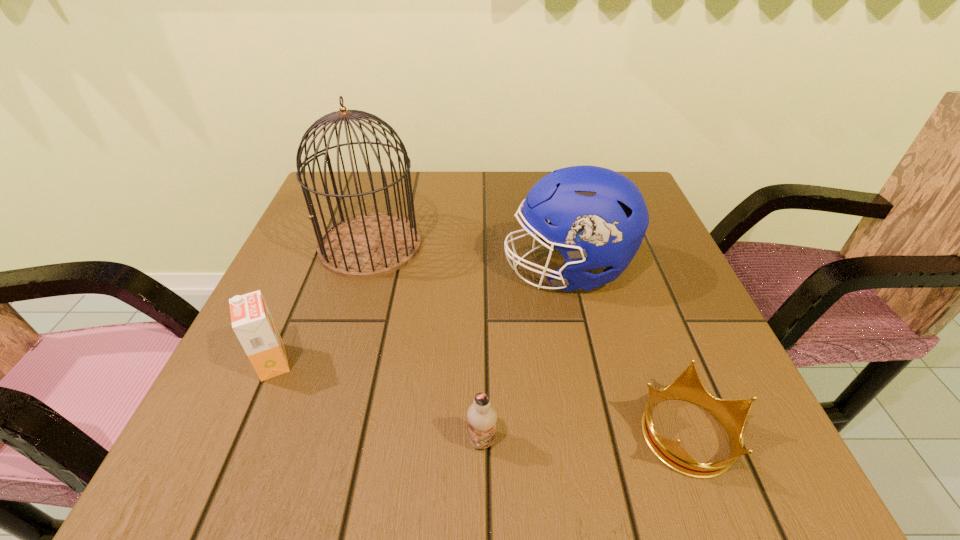
The height and width of the screenshot is (540, 960). Find the location of `vacant space in between the tallest object and the chocolate milk`. vacant space in between the tallest object and the chocolate milk is located at coordinates (426, 343).

This screenshot has width=960, height=540. Identify the location of free space between the third object from left to right and the birdcage. (426, 343).

Identify the location of free space between the crown and the third object from right to left. (586, 436).

Where is `free space between the shortest object and the second tallest object`? The width and height of the screenshot is (960, 540). free space between the shortest object and the second tallest object is located at coordinates (628, 351).

Find the location of a particular element. The height and width of the screenshot is (540, 960). vacant area that lies between the third tallest object and the birdcage is located at coordinates (322, 303).

Locate an element on the screen. Image resolution: width=960 pixels, height=540 pixels. free space between the tallest object and the second tallest object is located at coordinates (468, 258).

This screenshot has width=960, height=540. I want to click on unoccupied area between the chocolate milk and the third nearest object, so click(x=377, y=401).

This screenshot has width=960, height=540. In order to click on vacant region between the tallest object and the third object from left to right in this screenshot , I will do `click(426, 343)`.

Where is `the third closest object to the crown`? the third closest object to the crown is located at coordinates (369, 245).

Locate an element on the screen. Image resolution: width=960 pixels, height=540 pixels. the third closest object to the orange juice is located at coordinates (597, 218).